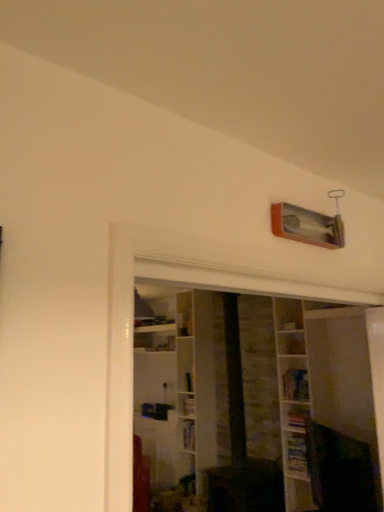
Question: Does hardcover book at lower right, placed as the second book when sorted from top to bottom, lie behind hardcover book at upper center, which appears as the 1th book when viewed from the top?

Choices:
 (A) yes
 (B) no

Answer: (B)

Question: From the image's perspective, does hardcover book at lower right, positioned as the second book in bottom-to-top order, appear higher than hardcover book at upper center, the 3th book positioned from the bottom?

Choices:
 (A) yes
 (B) no

Answer: (B)

Question: Is hardcover book at lower right, placed as the second book when sorted from top to bottom, completely or partially outside of hardcover book at upper center, the 3th book positioned from the bottom?

Choices:
 (A) yes
 (B) no

Answer: (A)

Question: From a real-world perspective, is hardcover book at lower right, placed as the second book when sorted from top to bottom, under hardcover book at upper center, the 3th book positioned from the bottom?

Choices:
 (A) yes
 (B) no

Answer: (A)

Question: From the image's perspective, would you say hardcover book at lower right, positioned as the second book in bottom-to-top order, is shown under hardcover book at upper center, which appears as the 1th book when viewed from the top?

Choices:
 (A) yes
 (B) no

Answer: (A)

Question: Visually, is white wooden shelf at center positioned to the left or to the right of hardcover book at lower right, placed as the second book when sorted from top to bottom?

Choices:
 (A) left
 (B) right

Answer: (B)

Question: Considering their positions, is white wooden shelf at center located in front of or behind hardcover book at lower right, positioned as the second book in bottom-to-top order?

Choices:
 (A) front
 (B) behind

Answer: (A)

Question: Which is correct: white wooden shelf at center is inside hardcover book at lower right, positioned as the second book in bottom-to-top order, or outside of it?

Choices:
 (A) outside
 (B) inside

Answer: (A)

Question: From a real-world perspective, is white wooden shelf at center positioned above or below hardcover book at lower right, positioned as the second book in bottom-to-top order?

Choices:
 (A) below
 (B) above

Answer: (B)

Question: Considering the positions of white wooden shelf at center and hardcover book at upper center, which appears as the 1th book when viewed from the top, in the image, is white wooden shelf at center wider or thinner than hardcover book at upper center, which appears as the 1th book when viewed from the top,?

Choices:
 (A) wide
 (B) thin

Answer: (A)

Question: Is white wooden shelf at center in front of or behind hardcover book at upper center, the 3th book positioned from the bottom, in the image?

Choices:
 (A) front
 (B) behind

Answer: (A)

Question: From a real-world perspective, relative to hardcover book at upper center, the 3th book positioned from the bottom, is white wooden shelf at center vertically above or below?

Choices:
 (A) above
 (B) below

Answer: (B)

Question: Is point (299, 350) positioned closer to the camera than point (304, 396)?

Choices:
 (A) closer
 (B) farther

Answer: (B)

Question: In terms of height, does hardcover book at upper center, which appears as the 1th book when viewed from the top, look taller or shorter compared to hardcover book at lower right, positioned as the 1th book in bottom-to-top order?

Choices:
 (A) short
 (B) tall

Answer: (A)

Question: From a real-world perspective, is hardcover book at upper center, which appears as the 1th book when viewed from the top, above or below hardcover book at lower right, positioned as the 1th book in bottom-to-top order?

Choices:
 (A) below
 (B) above

Answer: (B)